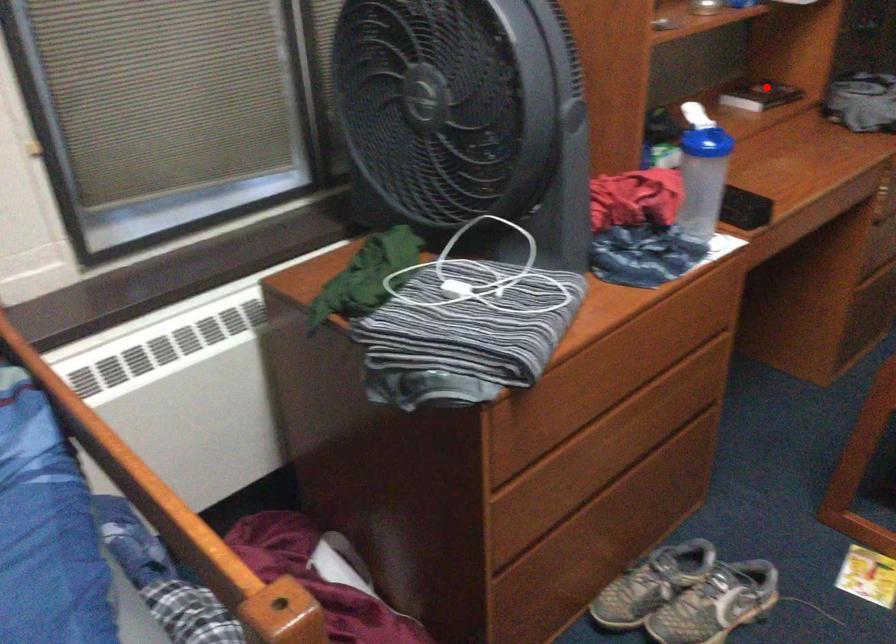
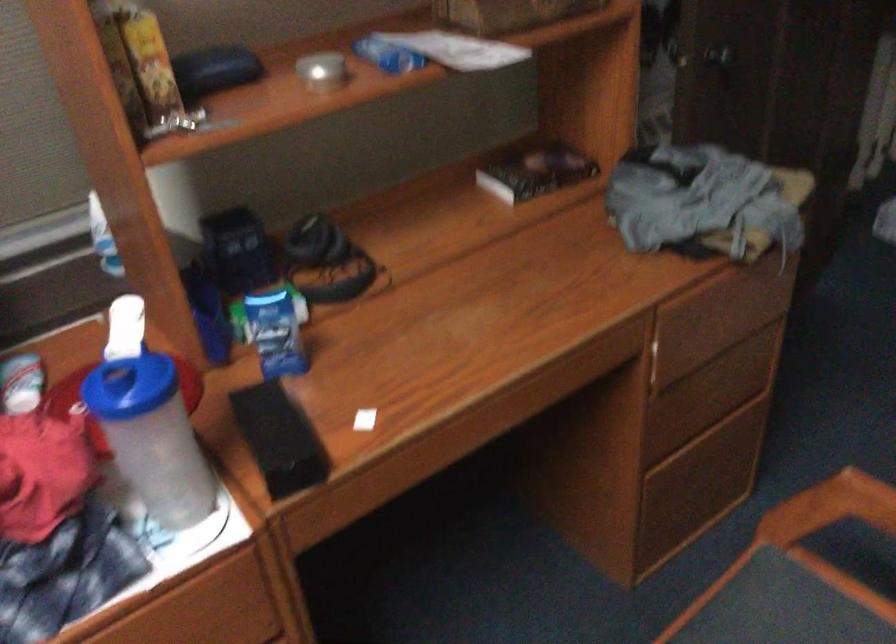
Question: I am providing you with two images of the same scene from different viewpoints. A red point is shown in image1. For the corresponding object point in image2, is it positioned nearer or farther from the camera?

Choices:
 (A) Nearer
 (B) Farther

Answer: (A)